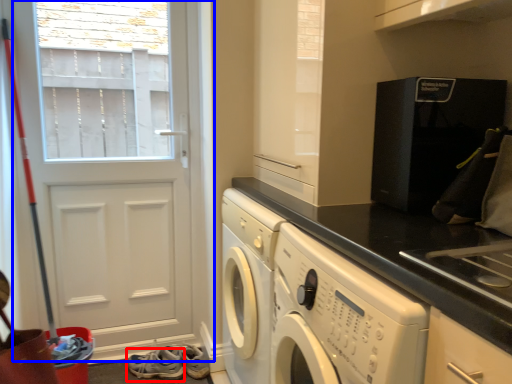
Question: Among these objects, which one is farthest to the camera, shoe (highlighted by a red box) or door (highlighted by a blue box)?

Choices:
 (A) shoe
 (B) door

Answer: (A)